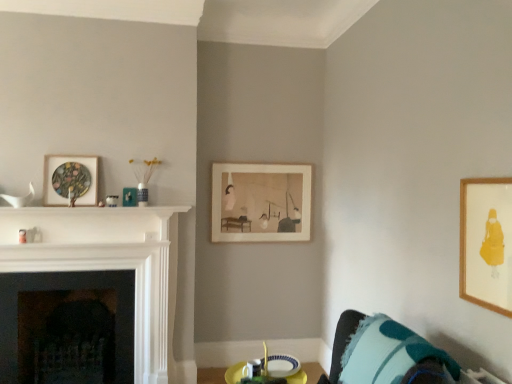
The width and height of the screenshot is (512, 384). In order to click on empty space that is ontop of wooden framed artwork at center, marked as the second picture frame in a right-to-left arrangement in this screenshot , I will do `click(265, 165)`.